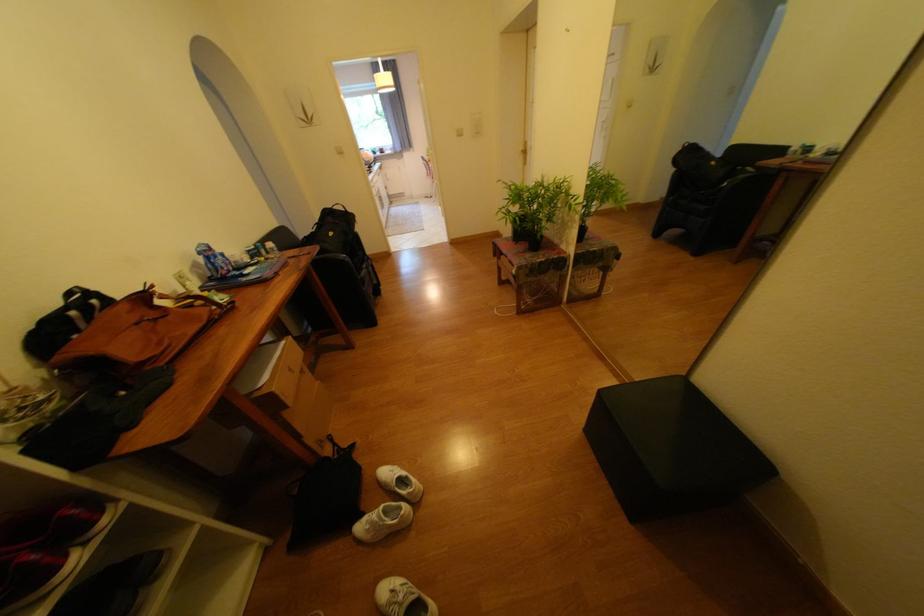
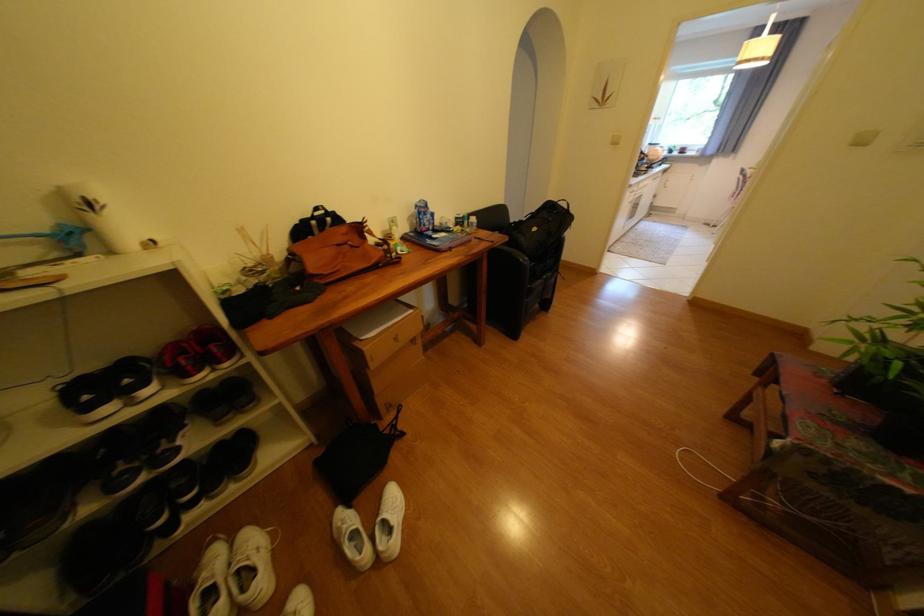
In the second image, find the point that corresponds to point (217, 257) in the first image.

(429, 214)